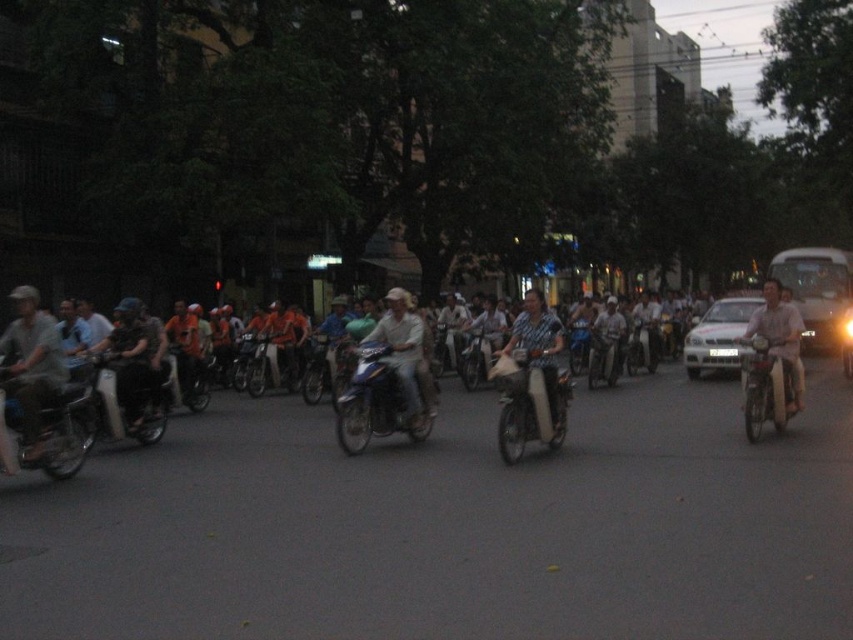
Question: Which point is farther to the camera?

Choices:
 (A) (392, 292)
 (B) (28, 348)
 (C) (108, 376)

Answer: (A)

Question: Which point is farther to the camera?

Choices:
 (A) matte gray helmet at left
 (B) light blue fabric shirt at center

Answer: (B)

Question: Is metallic blue motorcycle at center thinner than light beige fabric shirt at center?

Choices:
 (A) no
 (B) yes

Answer: (B)

Question: Does matte gray helmet at left appear on the left side of shiny black motorcycle at center?

Choices:
 (A) yes
 (B) no

Answer: (A)

Question: Which object is the closest to the metallic silver motorcycle at right?

Choices:
 (A) matte gray helmet at left
 (B) metallic silver scooter at left
 (C) light brown leather jacket at right
 (D) matte black motorcycle at center

Answer: (C)

Question: Is shiny black motorcycle at center smaller than metallic silver motorcycle at right?

Choices:
 (A) no
 (B) yes

Answer: (A)